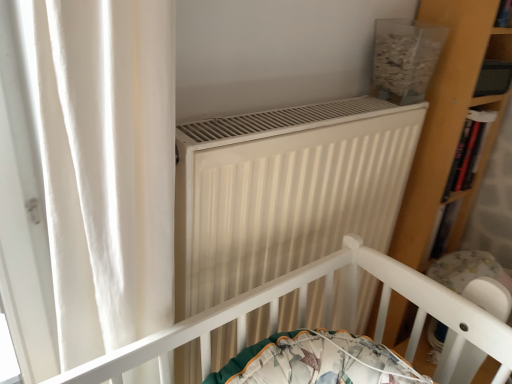
This screenshot has width=512, height=384. I want to click on wooden bookshelf at right, so click(x=469, y=150).

What do you see at coordinates (284, 191) in the screenshot? The width and height of the screenshot is (512, 384). I see `white matte radiator at center` at bounding box center [284, 191].

The image size is (512, 384). What do you see at coordinates (468, 270) in the screenshot? I see `white plastic baby carriage at lower right` at bounding box center [468, 270].

Where is `wooden bookshelf at right`? The height and width of the screenshot is (384, 512). wooden bookshelf at right is located at coordinates (469, 150).

Which object is thinner, wooden bookshelf at right or white plastic baby carriage at lower right?

wooden bookshelf at right.

Measure the distance between wooden bookshelf at right and white plastic baby carriage at lower right.

25.34 centimeters.

Does wooden bookshelf at right come in front of white plastic baby carriage at lower right?

No, wooden bookshelf at right is further to the viewer.

Which point is more distant from viewer, (x=462, y=151) or (x=438, y=259)?

The point (x=438, y=259) is behind.

Between white plastic baby carriage at lower right and wooden bookshelf at right, which one is positioned in front?

white plastic baby carriage at lower right is in front.

Is white plastic baby carriage at lower right far from wooden bookshelf at right?

No.

Does white plastic baby carriage at lower right have a greater height compared to wooden bookshelf at right?

In fact, white plastic baby carriage at lower right may be shorter than wooden bookshelf at right.

How far apart are white plastic baby carriage at lower right and wooden bookshelf at right?

They are 25.34 centimeters apart.

From a real-world perspective, is white plastic baby carriage at lower right positioned under white matte radiator at center based on gravity?

Yes, from a real-world perspective, white plastic baby carriage at lower right is beneath white matte radiator at center.

Does white plastic baby carriage at lower right have a lesser width compared to white matte radiator at center?

No.

Does white plastic baby carriage at lower right have a larger size compared to white matte radiator at center?

Actually, white plastic baby carriage at lower right might be smaller than white matte radiator at center.

Does point (446, 282) come behind point (201, 140)?

Yes, it is.

Which of these two, wooden bookshelf at right or white matte radiator at center, stands taller?

white matte radiator at center is taller.

Find the location of `heater that is below the wooden bookshelf at right (from the image's perspective)`. heater that is below the wooden bookshelf at right (from the image's perspective) is located at coordinates (284, 191).

Would you say wooden bookshelf at right is inside or outside white matte radiator at center?

wooden bookshelf at right is located beyond the bounds of white matte radiator at center.

Looking at this image, can you confirm if wooden bookshelf at right is wider than white matte radiator at center?

No, wooden bookshelf at right is not wider than white matte radiator at center.

Locate an element on the screen. The width and height of the screenshot is (512, 384). heater that is above the white plastic baby carriage at lower right (from a real-world perspective) is located at coordinates (284, 191).

Does white matte radiator at center turn towards white plastic baby carriage at lower right?

No, white matte radiator at center is not facing towards white plastic baby carriage at lower right.

Is white matte radiator at center in front of white plastic baby carriage at lower right?

Yes, it is in front of white plastic baby carriage at lower right.

Is white matte radiator at center far from white plastic baby carriage at lower right?

That's not correct — white matte radiator at center is a little close to white plastic baby carriage at lower right.

Between point (333, 128) and point (458, 157), which one is positioned in front?

Positioned in front is point (333, 128).

Identify the location of shelf that appears above the white matte radiator at center (from a real-world perspective). (469, 150).

Is white matte radiator at center oriented towards wooden bookshelf at right?

No, white matte radiator at center does not turn towards wooden bookshelf at right.

Looking at the image, does white matte radiator at center seem bigger or smaller compared to wooden bookshelf at right?

white matte radiator at center is bigger than wooden bookshelf at right.

Image resolution: width=512 pixels, height=384 pixels. In order to click on baby carriage lying in front of the wooden bookshelf at right in this screenshot , I will do `click(468, 270)`.

Identify the location of shelf on the left of white plastic baby carriage at lower right. (469, 150).

When comparing their distances from white plastic baby carriage at lower right, does wooden bookshelf at right or white matte radiator at center seem further?

The object further to white plastic baby carriage at lower right is white matte radiator at center.

Consider the image. Which object lies nearer to the anchor point white matte radiator at center, white plastic baby carriage at lower right or wooden bookshelf at right?

Based on the image, white plastic baby carriage at lower right appears to be nearer to white matte radiator at center.

Which object lies further to the anchor point wooden bookshelf at right, white matte radiator at center or white plastic baby carriage at lower right?

Based on the image, white matte radiator at center appears to be further to wooden bookshelf at right.

From the image, which object appears to be farther from white matte radiator at center, wooden bookshelf at right or white plastic baby carriage at lower right?

wooden bookshelf at right lies further to white matte radiator at center than the other object.

From the image, which object appears to be farther from wooden bookshelf at right, white plastic baby carriage at lower right or white matte radiator at center?

white matte radiator at center is positioned further to the anchor wooden bookshelf at right.

Considering their positions, is white matte radiator at center positioned closer to white plastic baby carriage at lower right than wooden bookshelf at right?

wooden bookshelf at right.

Identify the location of shelf between white matte radiator at center and white plastic baby carriage at lower right from left to right. The height and width of the screenshot is (384, 512). (469, 150).